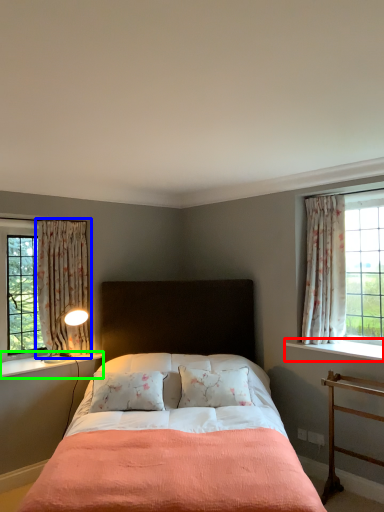
Question: Estimate the real-world distances between objects in this image. Which object is closer to window sill (highlighted by a red box), curtain (highlighted by a blue box) or window sill (highlighted by a green box)?

Choices:
 (A) curtain
 (B) window sill

Answer: (B)